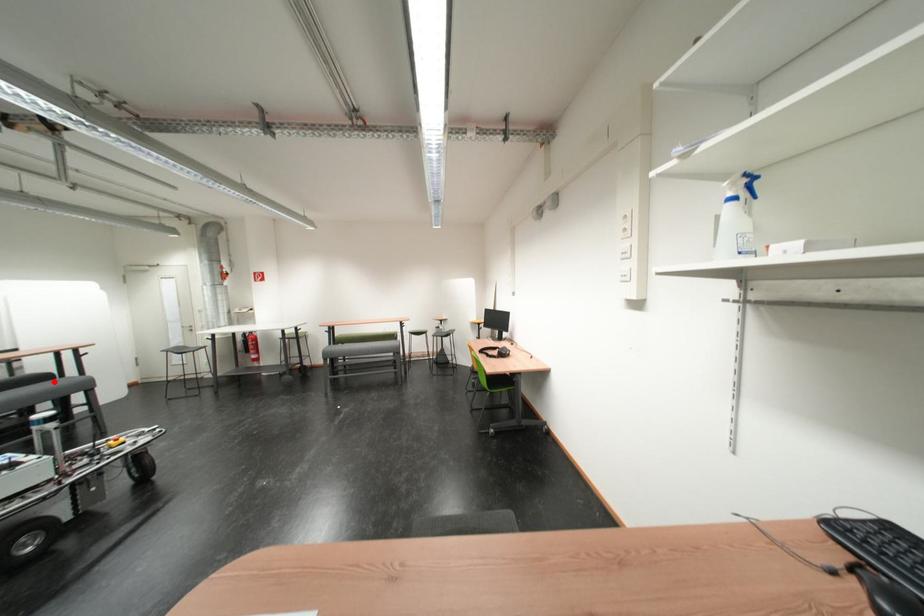
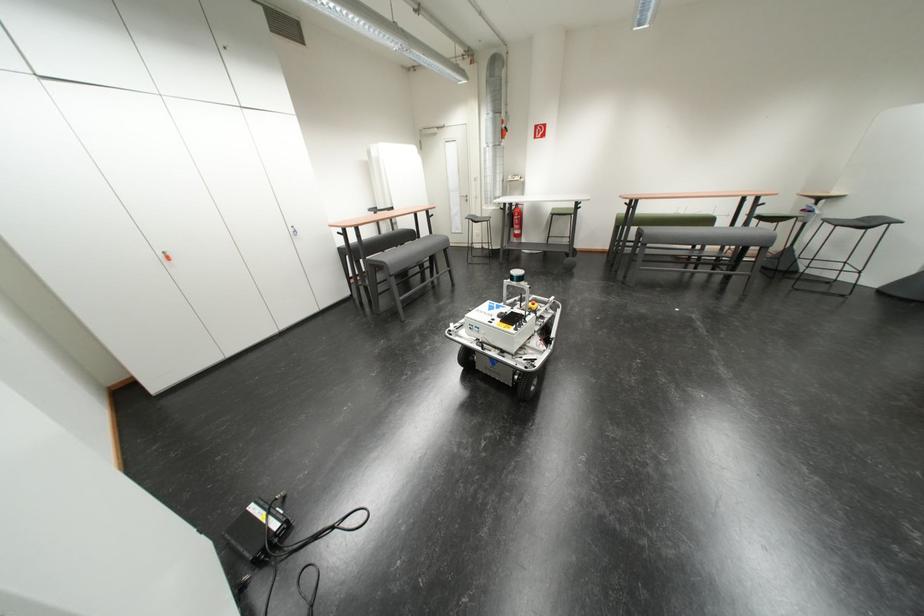
Question: A red point is marked in image1. In image2, is the corresponding 3D point closer to the camera or farther? Reply with the corresponding letter.

Choices:
 (A) The corresponding 3D point is closer.
 (B) The corresponding 3D point is farther.

Answer: (A)